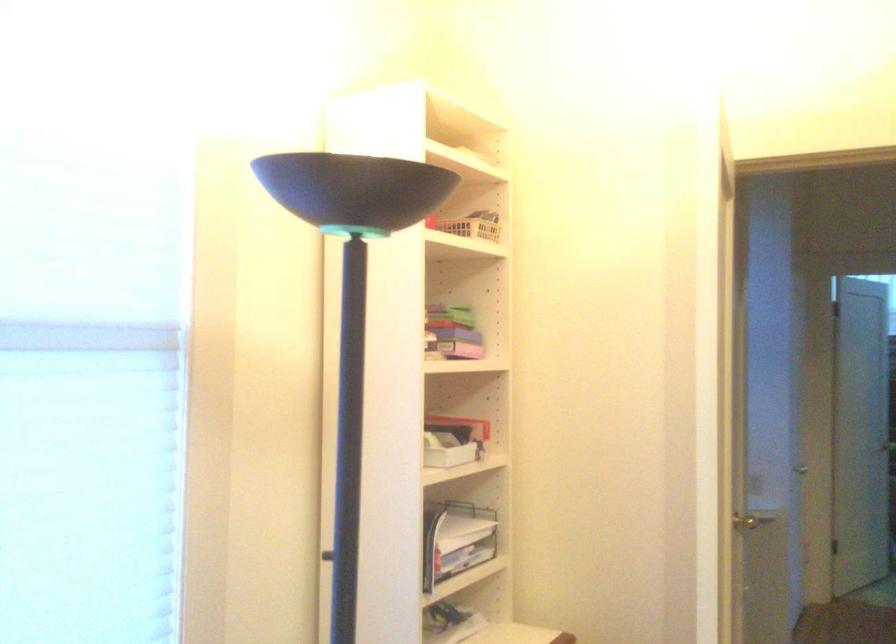
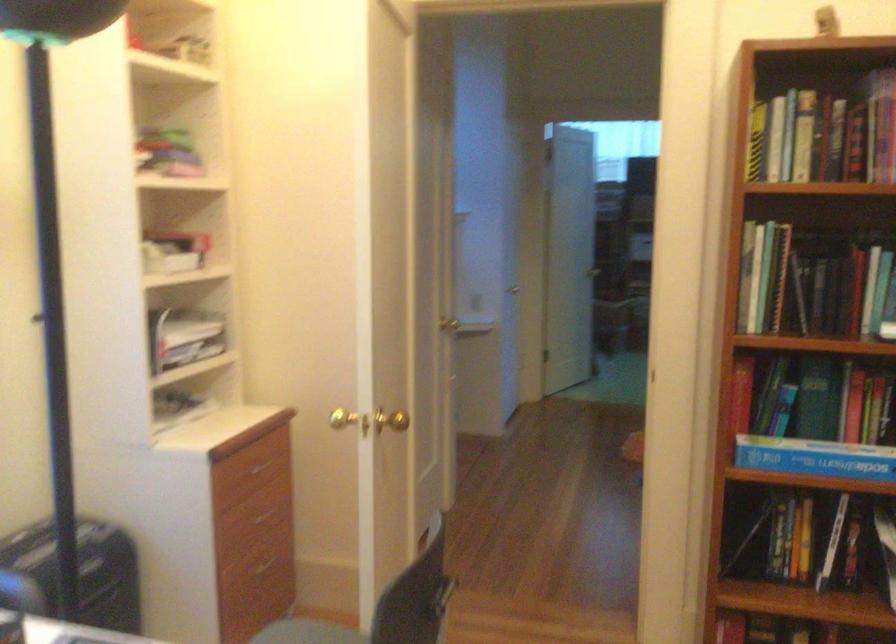
Question: The images are taken continuously from a first-person perspective. In which direction is your viewpoint rotating?

Choices:
 (A) Left
 (B) Right
 (C) Up
 (D) Down

Answer: (B)